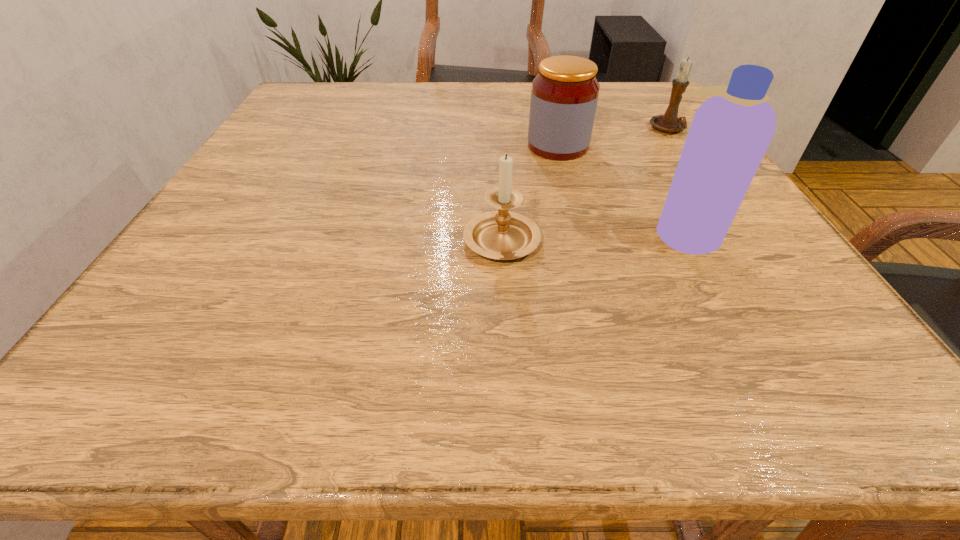
I want to click on free point between the jar and the farther candle holder, so click(613, 138).

Identify the location of free point between the jar and the left candle holder. (530, 192).

At what (x,y) coordinates should I click in order to perform the action: click on unoccupied position between the farther candle holder and the jar. Please return your answer as a coordinate pair (x, y). This screenshot has height=540, width=960. Looking at the image, I should click on (613, 138).

Find the location of a particular element. This screenshot has width=960, height=540. free space between the nearer candle holder and the tallest object is located at coordinates (592, 235).

What are the coordinates of `vacant point located between the jar and the leftmost object` in the screenshot? It's located at (530, 192).

Locate an element on the screen. unoccupied position between the right candle holder and the leftmost object is located at coordinates (586, 183).

Identify the location of empty location between the nearer candle holder and the right candle holder. This screenshot has height=540, width=960. (586, 183).

In order to click on free point between the nearer candle holder and the farther candle holder in this screenshot , I will do `click(586, 183)`.

Identify the location of empty location between the left candle holder and the jar. tap(530, 192).

Identify the location of the second closest object to the shampoo. This screenshot has width=960, height=540. (502, 235).